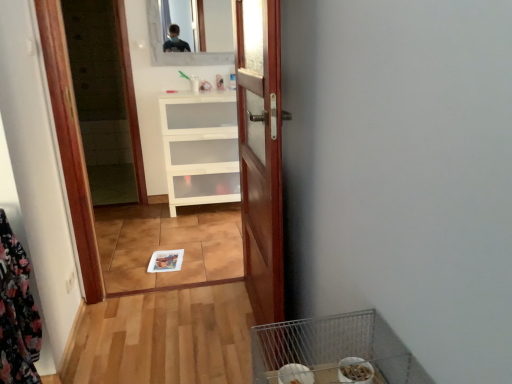
Question: Could you tell me if floral fabric laundry at left is facing metallic wire bird cage at lower right?

Choices:
 (A) no
 (B) yes

Answer: (B)

Question: Are floral fabric laundry at left and metallic wire bird cage at lower right beside each other?

Choices:
 (A) yes
 (B) no

Answer: (B)

Question: Considering the relative sizes of floral fabric laundry at left and metallic wire bird cage at lower right in the image provided, is floral fabric laundry at left bigger than metallic wire bird cage at lower right?

Choices:
 (A) no
 (B) yes

Answer: (B)

Question: From the image's perspective, is floral fabric laundry at left below metallic wire bird cage at lower right?

Choices:
 (A) no
 (B) yes

Answer: (A)

Question: Is the position of floral fabric laundry at left less distant than that of metallic wire bird cage at lower right?

Choices:
 (A) no
 (B) yes

Answer: (A)

Question: Considering the relative sizes of floral fabric laundry at left and metallic wire bird cage at lower right in the image provided, is floral fabric laundry at left smaller than metallic wire bird cage at lower right?

Choices:
 (A) no
 (B) yes

Answer: (A)

Question: Is wooden door at center at the right side of floral fabric laundry at left?

Choices:
 (A) no
 (B) yes

Answer: (B)

Question: From a real-world perspective, does wooden door at center stand above floral fabric laundry at left?

Choices:
 (A) no
 (B) yes

Answer: (B)

Question: Does wooden door at center touch floral fabric laundry at left?

Choices:
 (A) yes
 (B) no

Answer: (B)

Question: Can you confirm if wooden door at center is wider than floral fabric laundry at left?

Choices:
 (A) no
 (B) yes

Answer: (A)

Question: Does wooden door at center have a lesser width compared to floral fabric laundry at left?

Choices:
 (A) yes
 (B) no

Answer: (A)

Question: Is wooden door at center not close to floral fabric laundry at left?

Choices:
 (A) no
 (B) yes

Answer: (A)

Question: Is clear glass mirror at upper center taller than floral fabric laundry at left?

Choices:
 (A) yes
 (B) no

Answer: (B)